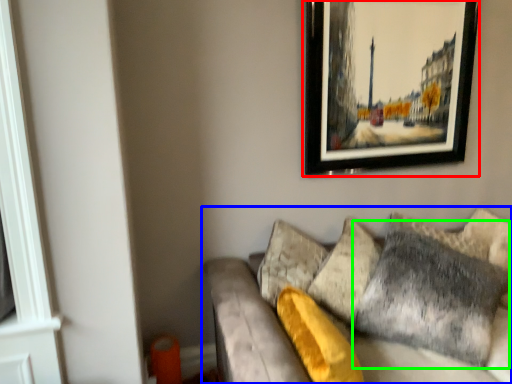
Question: Which is nearer to the picture frame (highlighted by a red box)? studio couch (highlighted by a blue box) or pillow (highlighted by a green box).

Choices:
 (A) studio couch
 (B) pillow

Answer: (A)